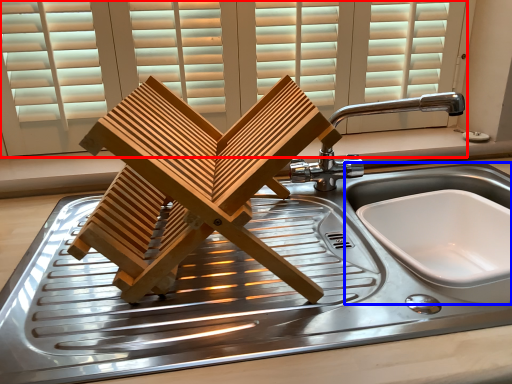
Question: Among these objects, which one is farthest to the camera, window (highlighted by a red box) or sink (highlighted by a blue box)?

Choices:
 (A) window
 (B) sink

Answer: (A)